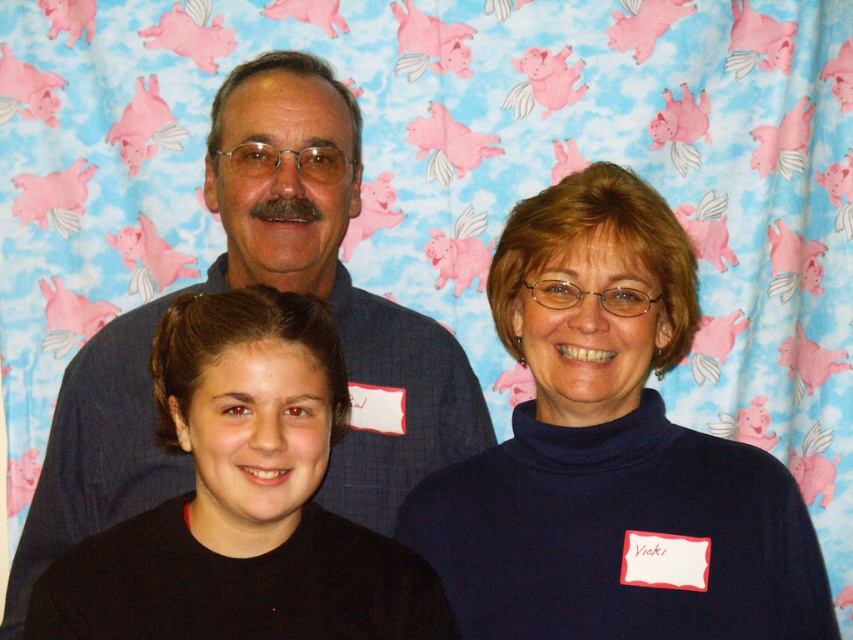
Question: Can you confirm if dark blue turtleneck sweater at center is positioned above blue denim shirt at upper center?

Choices:
 (A) yes
 (B) no

Answer: (B)

Question: Which point is farther to the camera?

Choices:
 (A) dark blue turtleneck sweater at center
 (B) blue denim shirt at upper center

Answer: (B)

Question: Can you confirm if dark blue turtleneck sweater at center is positioned to the right of blue denim shirt at upper center?

Choices:
 (A) no
 (B) yes

Answer: (B)

Question: Does dark blue turtleneck sweater at center have a greater width compared to blue denim shirt at upper center?

Choices:
 (A) yes
 (B) no

Answer: (B)